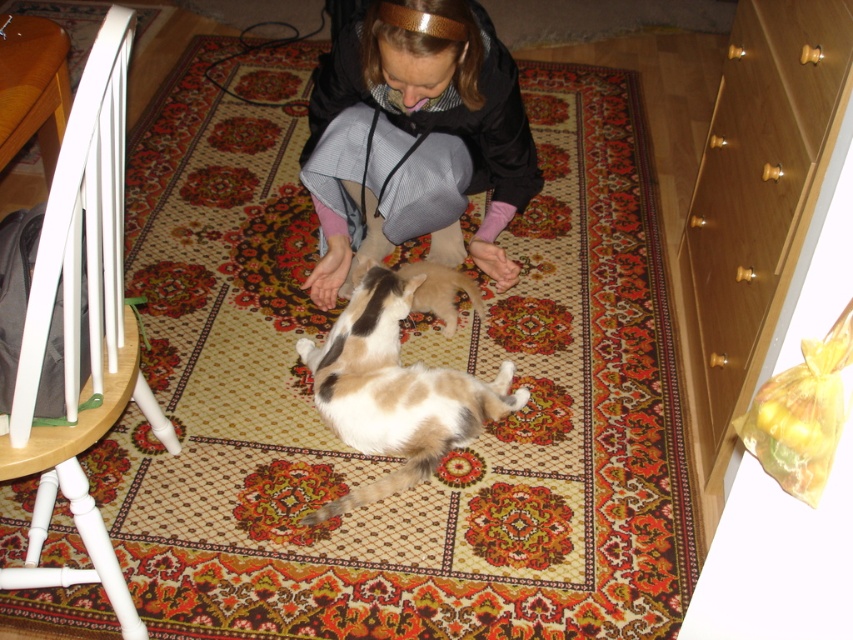
Does light brown wood drawer at right appear over black hoodie at center?

No.

The width and height of the screenshot is (853, 640). I want to click on light brown wood drawer at right, so click(x=757, y=195).

Between point (781, 257) and point (349, 205), which one is positioned in front?

Positioned in front is point (781, 257).

Identify the location of light brown wood drawer at right. (757, 195).

Does black hoodie at center appear under brown and white fur cat at center?

No.

Does black hoodie at center appear over brown and white fur cat at center?

Yes.

Where is `black hoodie at center`? The width and height of the screenshot is (853, 640). black hoodie at center is located at coordinates (416, 138).

You are a GUI agent. You are given a task and a screenshot of the screen. Output one action in this format:
    pyautogui.click(x=<x>, y=<y>)
    Task: Click on the black hoodie at center
    
    Given the screenshot: What is the action you would take?
    pyautogui.click(x=416, y=138)

Which is below, light brown wood drawer at right or brown and white fur cat at center?

brown and white fur cat at center is below.

Between light brown wood drawer at right and brown and white fur cat at center, which one is positioned higher?

Positioned higher is light brown wood drawer at right.

Who is more forward, (701, 422) or (432, 422)?

Point (432, 422)

Locate an element on the screen. light brown wood drawer at right is located at coordinates (757, 195).